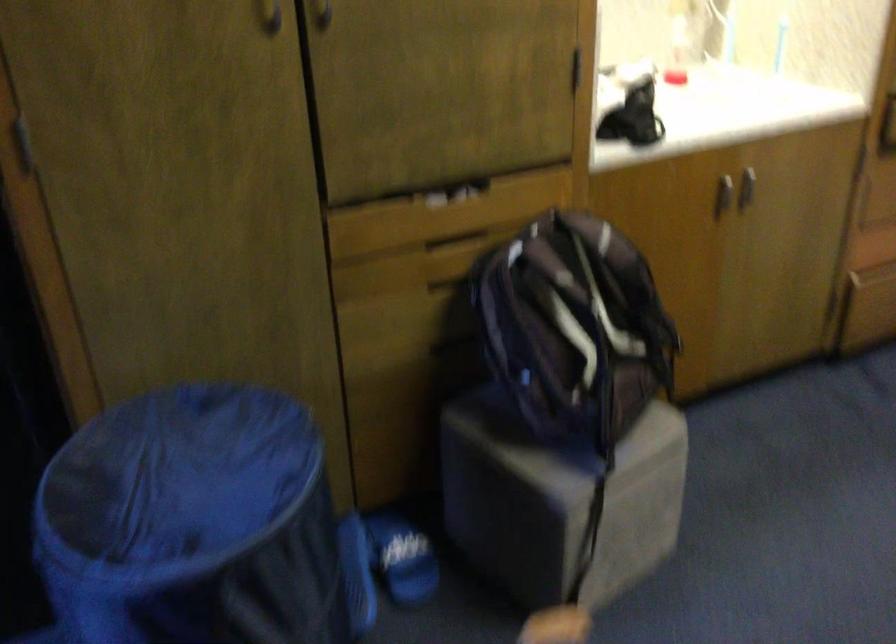
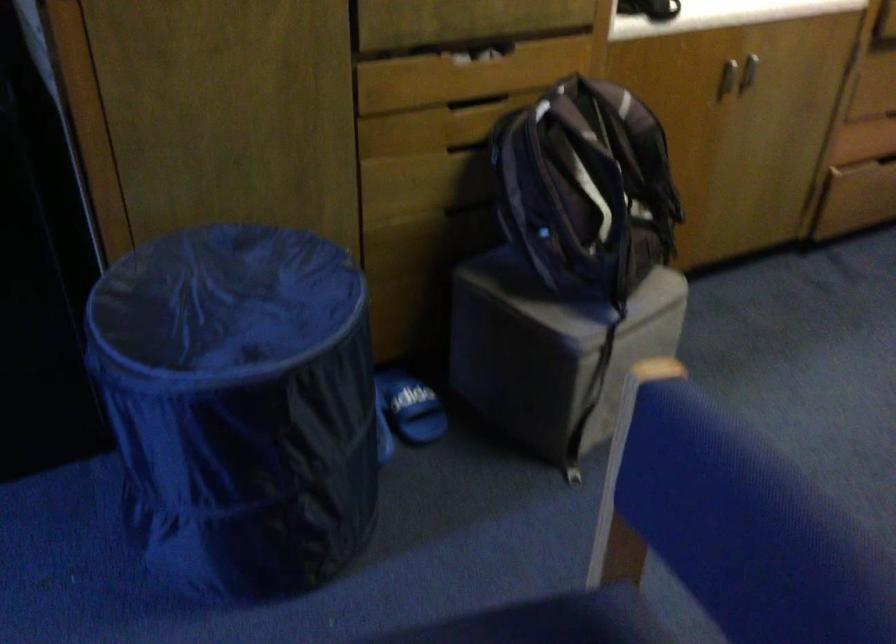
Where in the second image is the point corresponding to (565,333) from the first image?

(586, 187)